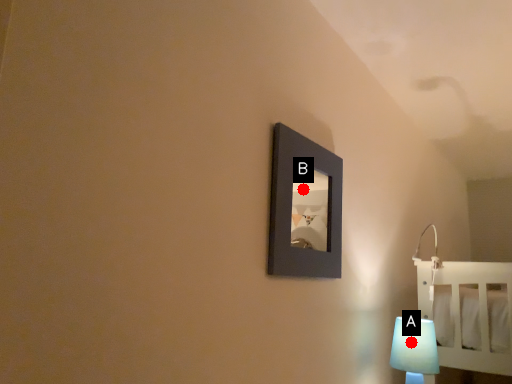
Question: Two points are circled on the image, labeled by A and B beside each circle. Among these points, which one is nearest to the camera?

Choices:
 (A) A is closer
 (B) B is closer

Answer: (A)